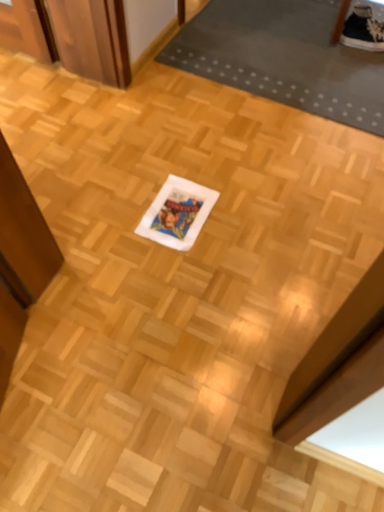
Where is `dark gray rubber mat at upper right`? The image size is (384, 512). dark gray rubber mat at upper right is located at coordinates (283, 58).

What do you see at coordinates (283, 58) in the screenshot? I see `dark gray rubber mat at upper right` at bounding box center [283, 58].

Image resolution: width=384 pixels, height=512 pixels. I want to click on dark gray rubber mat at upper right, so click(283, 58).